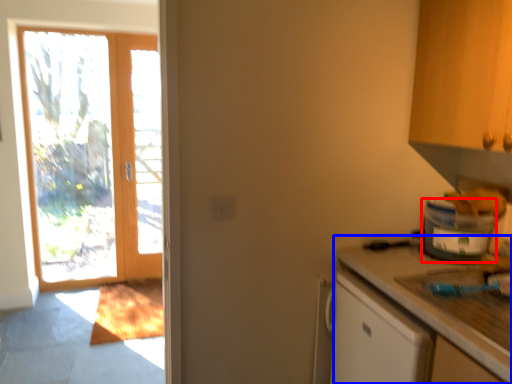
Question: Which object is closer to the camera taking this photo, appliance (highlighted by a red box) or countertop (highlighted by a blue box)?

Choices:
 (A) appliance
 (B) countertop

Answer: (B)